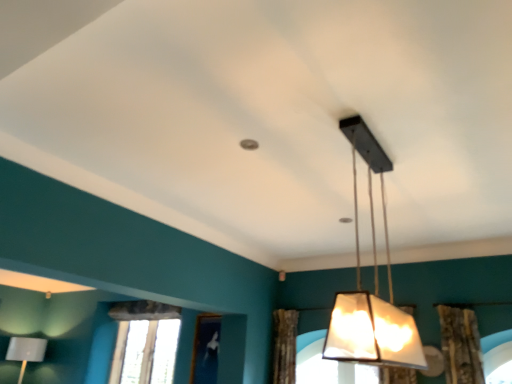
Question: Is brown textured curtain at center outside matte black lampshade at center, the 2th lamp from the left?

Choices:
 (A) no
 (B) yes

Answer: (B)

Question: From the image's perspective, is brown textured curtain at center over matte black lampshade at center, the 2th lamp from the left?

Choices:
 (A) yes
 (B) no

Answer: (B)

Question: Can you confirm if brown textured curtain at center is smaller than matte black lampshade at center, the 2th lamp from the left?

Choices:
 (A) yes
 (B) no

Answer: (A)

Question: Is brown textured curtain at center looking in the opposite direction of matte black lampshade at center, which is the first lamp in right-to-left order?

Choices:
 (A) yes
 (B) no

Answer: (B)

Question: Does brown textured curtain at center have a lesser width compared to matte black lampshade at center, which is the first lamp in right-to-left order?

Choices:
 (A) no
 (B) yes

Answer: (A)

Question: From their relative heights in the image, would you say matte black lampshade at center, the second lamp positioned from the bottom, is taller or shorter than clear glass window at lower left?

Choices:
 (A) short
 (B) tall

Answer: (B)

Question: Looking at their shapes, would you say matte black lampshade at center, the second lamp positioned from the bottom, is wider or thinner than clear glass window at lower left?

Choices:
 (A) thin
 (B) wide

Answer: (B)

Question: Is matte black lampshade at center, the second lamp positioned from the bottom, in front of or behind clear glass window at lower left in the image?

Choices:
 (A) front
 (B) behind

Answer: (A)

Question: From a real-world perspective, is matte black lampshade at center, acting as the first lamp starting from the top, physically located above or below clear glass window at lower left?

Choices:
 (A) below
 (B) above

Answer: (B)

Question: In the image, is matte gray lampshade at lower left, placed as the second lamp when sorted from top to bottom, positioned in front of or behind clear glass window at lower left?

Choices:
 (A) front
 (B) behind

Answer: (B)

Question: From the image's perspective, is matte gray lampshade at lower left, positioned as the 2th lamp in front-to-back order, located above or below clear glass window at lower left?

Choices:
 (A) below
 (B) above

Answer: (A)

Question: Considering the positions of matte gray lampshade at lower left, which ranks as the 1th lamp in left-to-right order, and clear glass window at lower left in the image, is matte gray lampshade at lower left, which ranks as the 1th lamp in left-to-right order, bigger or smaller than clear glass window at lower left?

Choices:
 (A) small
 (B) big

Answer: (B)

Question: Considering the relative positions of matte gray lampshade at lower left, which is the 1th lamp from back to front, and clear glass window at lower left in the image provided, is matte gray lampshade at lower left, which is the 1th lamp from back to front, to the left or to the right of clear glass window at lower left?

Choices:
 (A) right
 (B) left

Answer: (B)

Question: From a real-world perspective, relative to brown textured curtain at center, is matte gray lampshade at lower left, arranged as the first lamp when ordered from the bottom, vertically above or below?

Choices:
 (A) below
 (B) above

Answer: (A)

Question: Is matte gray lampshade at lower left, which is the second lamp from right to left, inside or outside of brown textured curtain at center?

Choices:
 (A) outside
 (B) inside

Answer: (A)